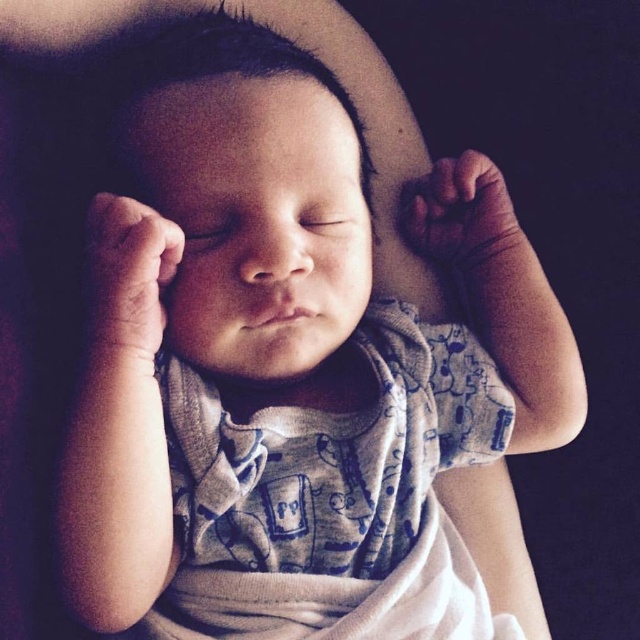
Question: Which of the following is the closest to the observer?

Choices:
 (A) coord(147,218)
 (B) coord(518,250)

Answer: (A)

Question: Can you confirm if smooth skin hand at center is wider than smooth skin hand at upper center?

Choices:
 (A) yes
 (B) no

Answer: (B)

Question: Does smooth skin hand at center have a larger size compared to smooth skin hand at upper center?

Choices:
 (A) yes
 (B) no

Answer: (B)

Question: Is smooth skin hand at center above smooth skin hand at upper center?

Choices:
 (A) no
 (B) yes

Answer: (A)